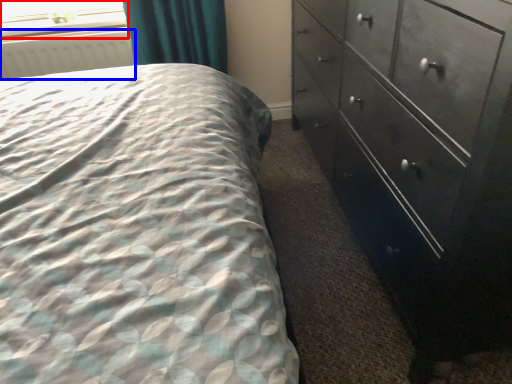
Question: Which object is closer to the camera taking this photo, window screen (highlighted by a red box) or radiator (highlighted by a blue box)?

Choices:
 (A) window screen
 (B) radiator

Answer: (B)